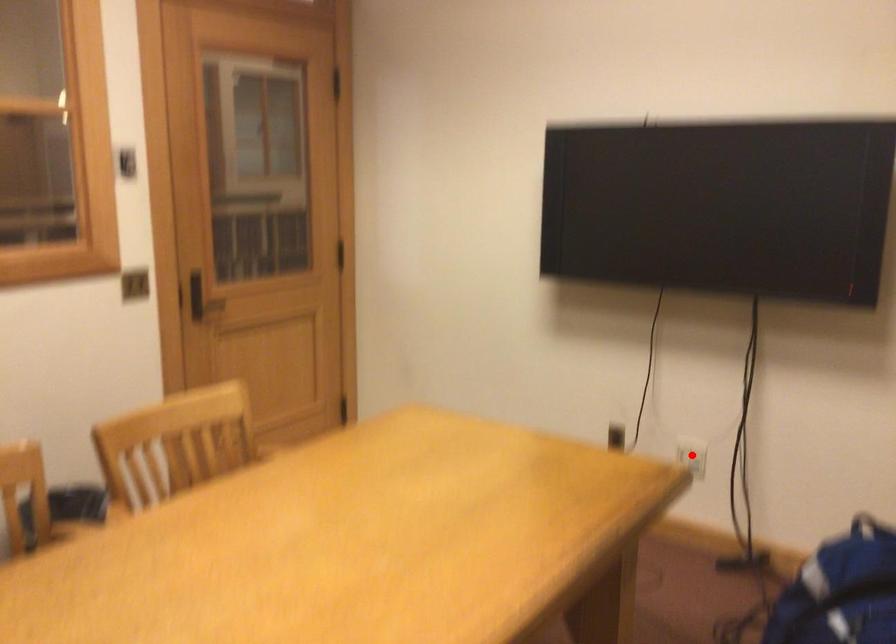
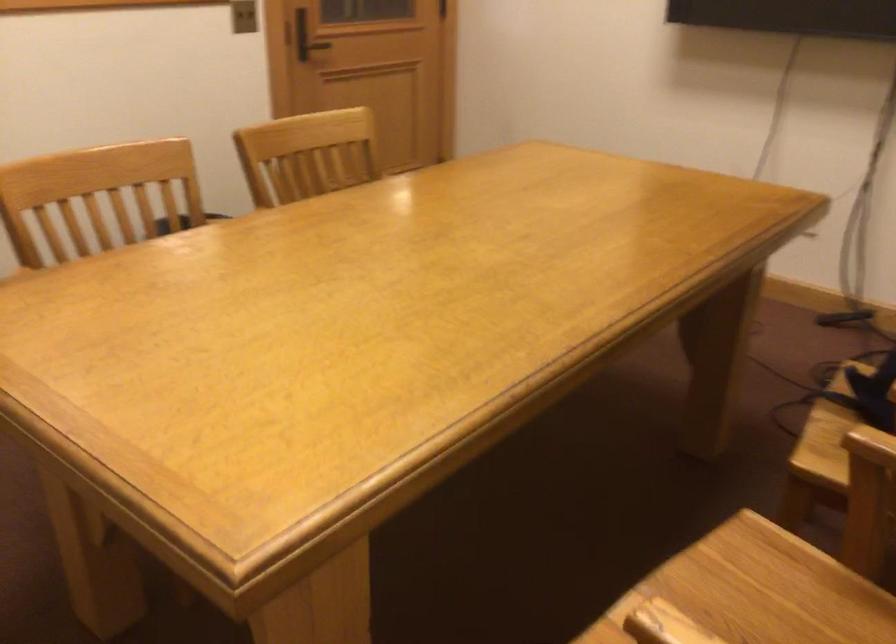
Question: I am providing you with two images of the same scene from different viewpoints. A red point is marked on the first image. Can you still see the location of the red point in image 2?

Choices:
 (A) Yes
 (B) No

Answer: (B)